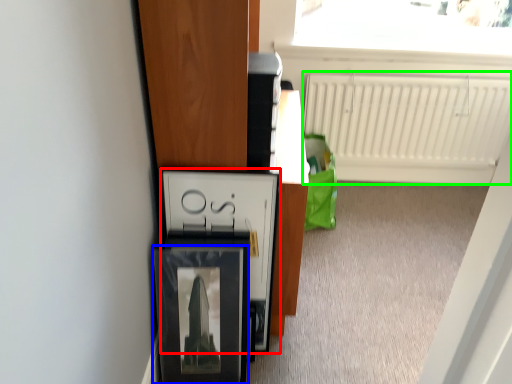
Question: Estimate the real-world distances between objects in this image. Which object is farther from cabinetry (highlighted by a red box), picture frame (highlighted by a blue box) or radiator (highlighted by a green box)?

Choices:
 (A) picture frame
 (B) radiator

Answer: (B)